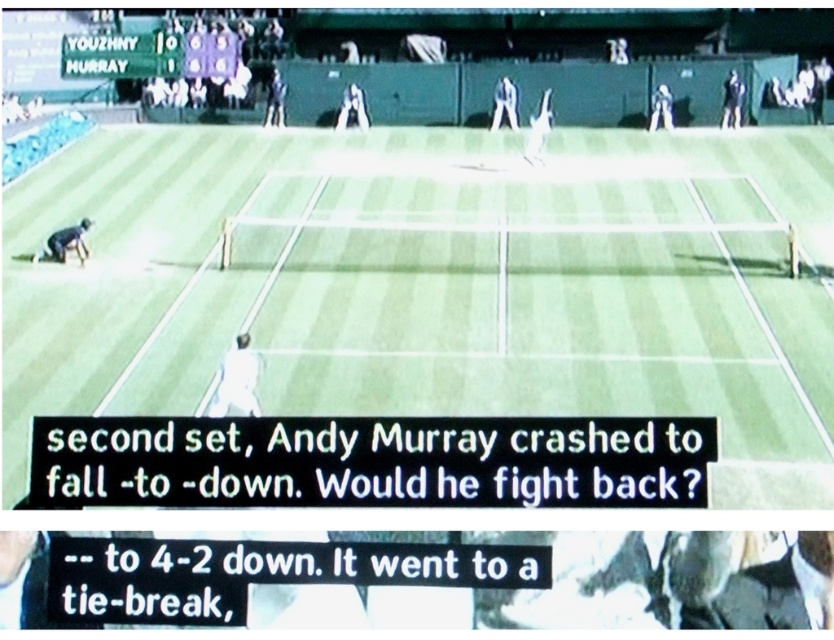
In the scene shown: Can you confirm if white fabric tennis player at center is thinner than black fabric person at upper right?

Incorrect, white fabric tennis player at center's width is not less than black fabric person at upper right's.

Looking at this image, can you confirm if white fabric tennis player at center is wider than black fabric person at upper right?

Correct, the width of white fabric tennis player at center exceeds that of black fabric person at upper right.

Between point (239, 358) and point (734, 70), which one is positioned behind?

Positioned behind is point (734, 70).

At what (x,y) coordinates should I click in order to perform the action: click on white fabric tennis player at center. Please return your answer as a coordinate pair (x, y). This screenshot has width=834, height=640. Looking at the image, I should click on (237, 380).

Is green grass tennis court at center positioned in front of white fabric tennis player at upper center?

Yes, green grass tennis court at center is closer to the viewer.

Who is more distant from viewer, (505, 378) or (500, 120)?

The point (500, 120) is behind.

This screenshot has height=640, width=834. What are the coordinates of `green grass tennis court at center` in the screenshot? It's located at (436, 284).

Can you confirm if dark blue shirt at upper center is positioned to the right of white fabric person at upper right?

In fact, dark blue shirt at upper center is to the left of white fabric person at upper right.

Can you confirm if dark blue shirt at upper center is thinner than white fabric person at upper right?

No.

Is point (354, 120) closer to viewer compared to point (657, 100)?

No.

What are the coordinates of `dark blue shirt at upper center` in the screenshot? It's located at (352, 108).